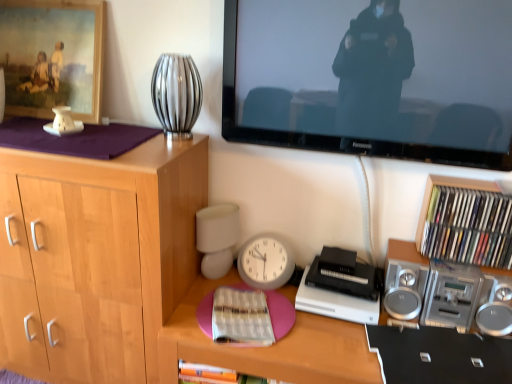
Image resolution: width=512 pixels, height=384 pixels. I want to click on vacant space to the left of multicolored paper book at right, arranged as the 2th book when ordered from the bottom, so click(413, 257).